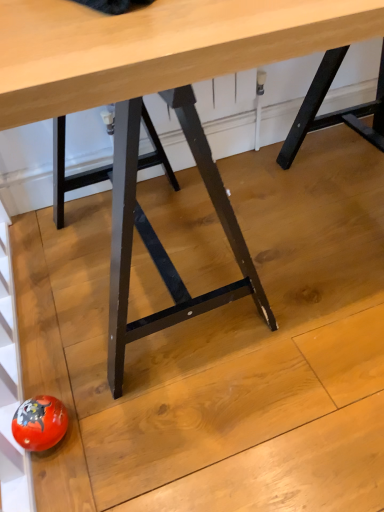
Looking at this image, what is the approximate width of shiny red ball at lower left?

3.98 inches.

Image resolution: width=384 pixels, height=512 pixels. I want to click on shiny red ball at lower left, so click(x=39, y=423).

The height and width of the screenshot is (512, 384). What do you see at coordinates (39, 423) in the screenshot?
I see `shiny red ball at lower left` at bounding box center [39, 423].

Image resolution: width=384 pixels, height=512 pixels. What are the coordinates of `shiny red ball at lower left` in the screenshot? It's located at (39, 423).